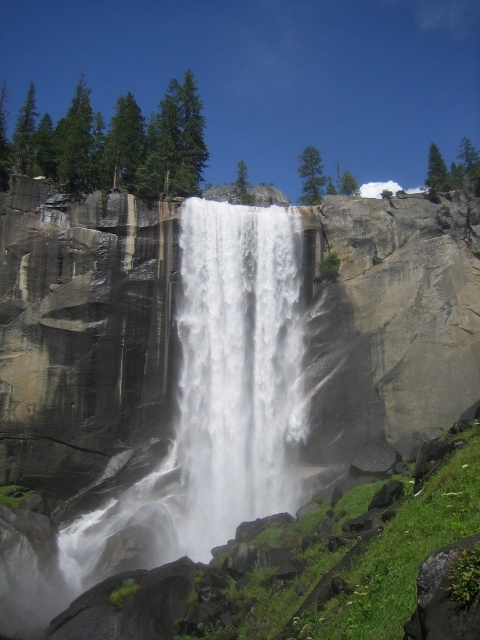
Is gray/rough rock face at center behind white frothy water at center?

No, it is in front of white frothy water at center.

Is gray/rough rock face at center to the right of white frothy water at center from the viewer's perspective?

In fact, gray/rough rock face at center is to the left of white frothy water at center.

Is point (116, 492) behind point (217, 205)?

That is False.

Image resolution: width=480 pixels, height=640 pixels. What are the coordinates of `gray/rough rock face at center` in the screenshot? It's located at (210, 365).